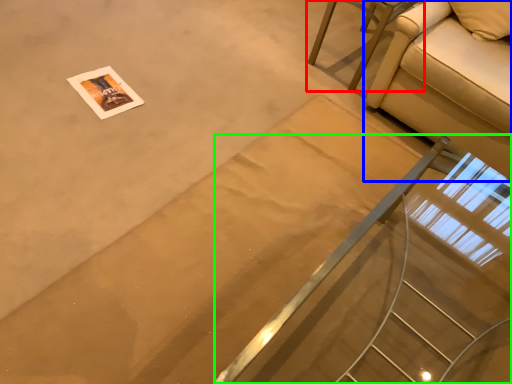
Question: Based on their relative distances, which object is nearer to furniture (highlighted by a red box)? Choose from studio couch (highlighted by a blue box) and stairs (highlighted by a green box).

Choices:
 (A) studio couch
 (B) stairs

Answer: (A)